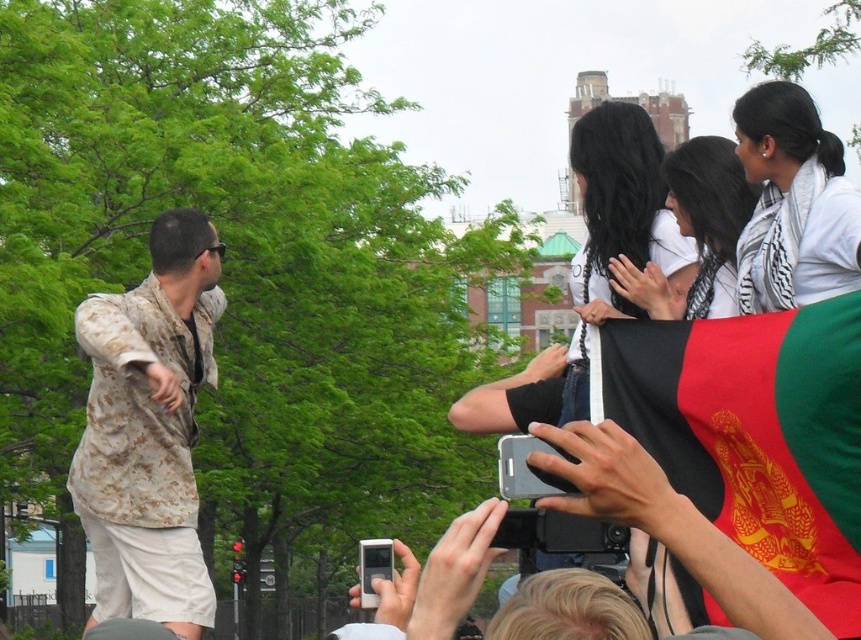
You are a photographer trying to capture the camouflage fabric shirt at center. The camera you are using has a focal point set at point (669, 525). Is the focal point correctly positioned to capture the camouflage fabric shirt at center?

Yes, the focal point at point (669, 525) corresponds to the camouflage fabric shirt at center, so it is correctly positioned to capture it.

You are a photographer trying to capture a clear shot of the camouflage fabric shirt at center and the black silky hair at upper center. Which object should you zoom in on to ensure it fits better in your frame?

The camouflage fabric shirt at center has a larger width compared to the black silky hair at upper center, so you should zoom in on the camouflage fabric shirt at center to ensure it fits better in your frame.

Looking at this image, you are a photographer trying to capture the man on the stage from the crowd. You notice the black fabric flag at upper right and the white scarf at upper right might block your view. Which object is more likely to obstruct your shot?

The black fabric flag at upper right is closer to the viewer than the white scarf at upper right, so it is more likely to obstruct your shot.